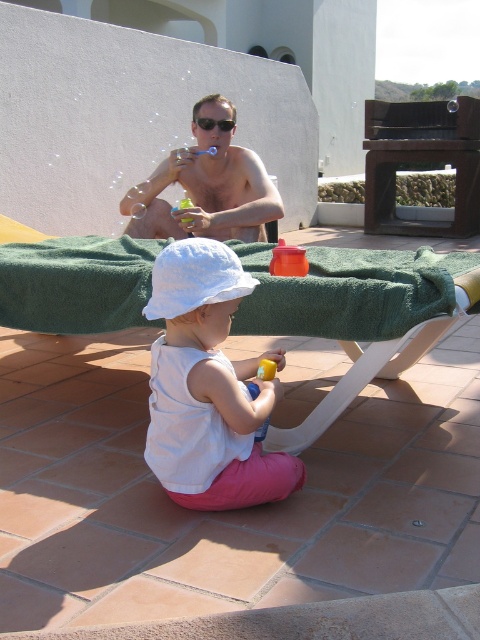
Question: Which is farther from the sunglasses at upper center?

Choices:
 (A) white cotton hat at center
 (B) white plastic beach chair at center
 (C) matte plastic cup at upper center

Answer: (A)

Question: Does matte plastic cup at upper center appear over sunglasses at upper center?

Choices:
 (A) yes
 (B) no

Answer: (B)

Question: Which point appears farthest from the camera in this image?

Choices:
 (A) (211, 369)
 (B) (204, 125)

Answer: (B)

Question: Can you confirm if white cotton hat at center is positioned below white plastic beach chair at center?

Choices:
 (A) no
 (B) yes

Answer: (A)

Question: Among these objects, which one is nearest to the camera?

Choices:
 (A) sunglasses at upper center
 (B) green fuzzy bath towel at center
 (C) matte plastic cup at upper center
 (D) white cotton hat at center

Answer: (D)

Question: Is white cotton hat at center smaller than sunglasses at upper center?

Choices:
 (A) yes
 (B) no

Answer: (B)